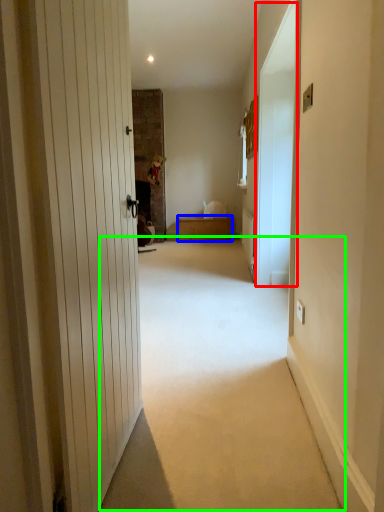
Question: Which object is positioned closest to screen door (highlighted by a red box)? Select from furniture (highlighted by a blue box) and corridor (highlighted by a green box).

Choices:
 (A) furniture
 (B) corridor

Answer: (B)